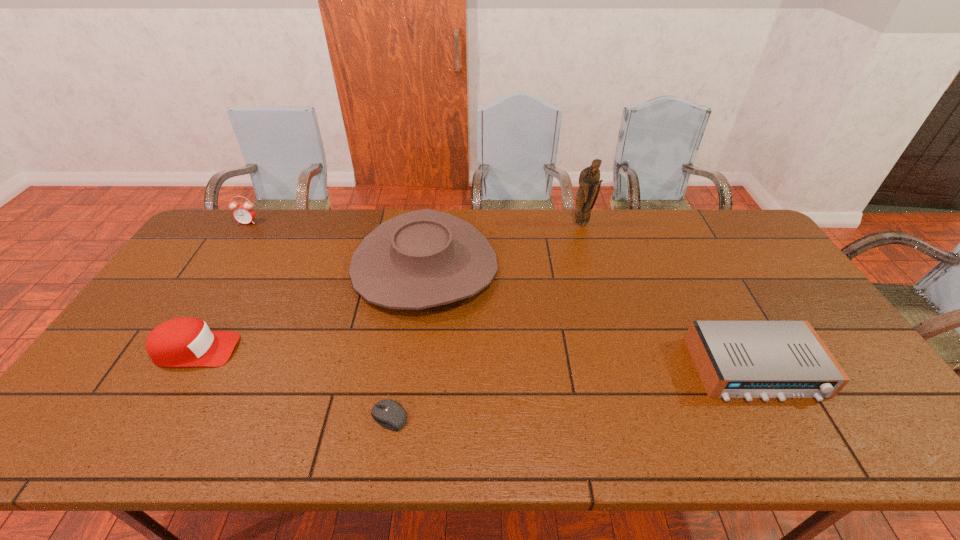
The height and width of the screenshot is (540, 960). I want to click on object that is at the right edge, so click(x=735, y=359).

Where is `object that is at the far left corner`? The width and height of the screenshot is (960, 540). object that is at the far left corner is located at coordinates (244, 213).

You are a GUI agent. You are given a task and a screenshot of the screen. Output one action in this format:
    pyautogui.click(x=<x>, y=<y>)
    Task: Click on the vacant space at the far edge of the desktop
    This screenshot has height=540, width=960.
    Given the screenshot: What is the action you would take?
    pyautogui.click(x=325, y=215)

In the image, there is a desktop. At what (x,y) coordinates should I click in order to perform the action: click on vacant space at the near edge. Please return your answer as a coordinate pair (x, y). Looking at the image, I should click on (710, 442).

You are a GUI agent. You are given a task and a screenshot of the screen. Output one action in this format:
    pyautogui.click(x=<x>, y=<y>)
    Task: Click on the free space at the right edge of the desktop
    
    Given the screenshot: What is the action you would take?
    pyautogui.click(x=772, y=285)

Where is `vacant space at the far left corner of the desktop`? Image resolution: width=960 pixels, height=540 pixels. vacant space at the far left corner of the desktop is located at coordinates (211, 236).

The height and width of the screenshot is (540, 960). I want to click on vacant area at the near left corner, so click(72, 453).

At what (x,y) coordinates should I click in order to perform the action: click on vacant region at the near right corner of the desktop. Please return your answer as a coordinate pair (x, y). This screenshot has height=540, width=960. Looking at the image, I should click on (915, 446).

This screenshot has width=960, height=540. In order to click on free point between the radio receiver and the baseball cap in this screenshot , I will do `click(475, 360)`.

Image resolution: width=960 pixels, height=540 pixels. I want to click on free space between the radio receiver and the alarm clock, so click(502, 295).